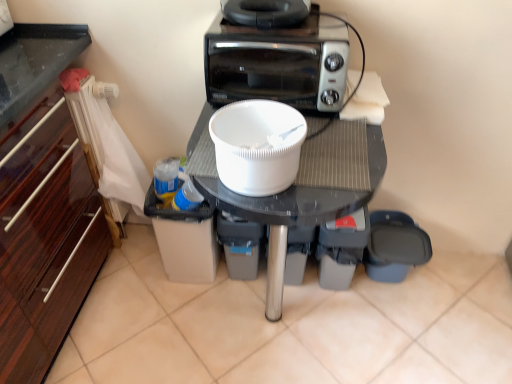
Measure the distance between point (257, 127) and camera.

A distance of 38.46 inches exists between point (257, 127) and camera.

What do you see at coordinates (310, 191) in the screenshot? The width and height of the screenshot is (512, 384). I see `white plastic table at center` at bounding box center [310, 191].

What are the coordinates of `white plastic table at center` in the screenshot? It's located at (310, 191).

Locate an element on the screen. This screenshot has height=384, width=512. black plastic toaster at upper center is located at coordinates (278, 63).

Looking at their sizes, would you say black rubber toaster at upper center is wider or thinner than white plastic bowl at center?

Clearly, black rubber toaster at upper center has more width compared to white plastic bowl at center.

Considering the positions of points (249, 23) and (275, 161), is point (249, 23) closer to camera compared to point (275, 161)?

No.

Is black rubber toaster at upper center turned away from white plastic bowl at center?

No, white plastic bowl at center is not at the back of black rubber toaster at upper center.

I want to click on appliance above the white plastic bowl at center (from a real-world perspective), so click(x=266, y=12).

From the image's perspective, between black plastic toaster at upper center and white plastic bowl at center, who is located below?

white plastic bowl at center is shown below in the image.

From a real-world perspective, which is physically below, black plastic toaster at upper center or white plastic bowl at center?

white plastic bowl at center is physically lower.

Can you confirm if black plastic toaster at upper center is bigger than white plastic bowl at center?

Correct, black plastic toaster at upper center is larger in size than white plastic bowl at center.

Is black plastic toaster at upper center wider than white plastic table at center?

Incorrect, the width of black plastic toaster at upper center does not surpass that of white plastic table at center.

From the image's perspective, who appears lower, black plastic toaster at upper center or white plastic table at center?

From the image's view, white plastic table at center is below.

In the image, there is a white plastic table at center. What are the coordinates of `home appliance above it (from the image's perspective)` in the screenshot? It's located at click(x=278, y=63).

Considering the relative positions of black plastic toaster at upper center and black rubber toaster at upper center in the image provided, is black plastic toaster at upper center to the left or to the right of black rubber toaster at upper center?

In the image, black plastic toaster at upper center appears on the right side of black rubber toaster at upper center.

Is black plastic toaster at upper center not within black rubber toaster at upper center?

black plastic toaster at upper center is positioned outside black rubber toaster at upper center.

How different are the orientations of black plastic toaster at upper center and black rubber toaster at upper center in degrees?

The facing directions of black plastic toaster at upper center and black rubber toaster at upper center are 8.66e-06 degrees apart.

From a real-world perspective, between white plastic bowl at center and black plastic toaster at upper center, who is vertically lower?

In real-world perspective, white plastic bowl at center is lower.

Which is farther from the camera, (225, 142) or (320, 65)?

The point (320, 65) is more distant.

Does white plastic bowl at center have a lesser height compared to black plastic toaster at upper center?

Correct, white plastic bowl at center is not as tall as black plastic toaster at upper center.

From a real-world perspective, between black rubber toaster at upper center and black plastic toaster at upper center, who is vertically higher?

From a 3D spatial view, black rubber toaster at upper center is above.

In order to click on home appliance on the right of black rubber toaster at upper center in this screenshot , I will do `click(278, 63)`.

From the picture: Is black rubber toaster at upper center oriented away from black plastic toaster at upper center?

No, black plastic toaster at upper center is not at the back of black rubber toaster at upper center.

How much distance is there between black rubber toaster at upper center and white plastic table at center?

black rubber toaster at upper center and white plastic table at center are 13.65 inches apart from each other.

From a real-world perspective, between black rubber toaster at upper center and white plastic table at center, who is vertically higher?

From a 3D spatial view, black rubber toaster at upper center is above.

Between black rubber toaster at upper center and white plastic table at center, which one has larger width?

white plastic table at center.

Is point (260, 6) closer or farther from the camera than point (230, 203)?

Clearly, point (260, 6) is more distant from the camera than point (230, 203).

This screenshot has height=384, width=512. I want to click on kitchen appliance to the left of black rubber toaster at upper center, so click(257, 146).

The width and height of the screenshot is (512, 384). What are the coordinates of `home appliance to the right of white plastic bowl at center` in the screenshot? It's located at (278, 63).

Which object lies nearer to the anchor point white plastic table at center, black plastic toaster at upper center or black rubber toaster at upper center?

black plastic toaster at upper center is positioned closer to the anchor white plastic table at center.

Estimate the real-world distances between objects in this image. Which object is closer to white plastic bowl at center, black rubber toaster at upper center or white plastic table at center?

Among the two, white plastic table at center is located nearer to white plastic bowl at center.

Which object lies further to the anchor point white plastic table at center, white plastic bowl at center or black rubber toaster at upper center?

Based on the image, black rubber toaster at upper center appears to be further to white plastic table at center.

Considering their positions, is white plastic bowl at center positioned closer to white plastic table at center than black plastic toaster at upper center?

white plastic bowl at center is closer to white plastic table at center.

Based on their spatial positions, is black plastic toaster at upper center or white plastic table at center closer to white plastic bowl at center?

The object closer to white plastic bowl at center is white plastic table at center.

Based on their spatial positions, is white plastic bowl at center or white plastic table at center further from black plastic toaster at upper center?

white plastic bowl at center.

Estimate the real-world distances between objects in this image. Which object is closer to white plastic bowl at center, white plastic table at center or black rubber toaster at upper center?

white plastic table at center.

Looking at the image, which one is located further to black rubber toaster at upper center, white plastic table at center or white plastic bowl at center?

Among the two, white plastic table at center is located further to black rubber toaster at upper center.

Where is `home appliance between black rubber toaster at upper center and white plastic table at center from top to bottom`? The height and width of the screenshot is (384, 512). home appliance between black rubber toaster at upper center and white plastic table at center from top to bottom is located at coordinates (278, 63).

I want to click on home appliance between black rubber toaster at upper center and white plastic bowl at center in the vertical direction, so click(x=278, y=63).

Locate an element on the screen. The height and width of the screenshot is (384, 512). kitchen appliance that lies between black plastic toaster at upper center and white plastic table at center from top to bottom is located at coordinates (257, 146).

You are a GUI agent. You are given a task and a screenshot of the screen. Output one action in this format:
    pyautogui.click(x=<x>, y=<y>)
    Task: Click on the kitchen appliance between black rubber toaster at upper center and white plastic table at center vertically
    This screenshot has height=384, width=512.
    Given the screenshot: What is the action you would take?
    pyautogui.click(x=257, y=146)